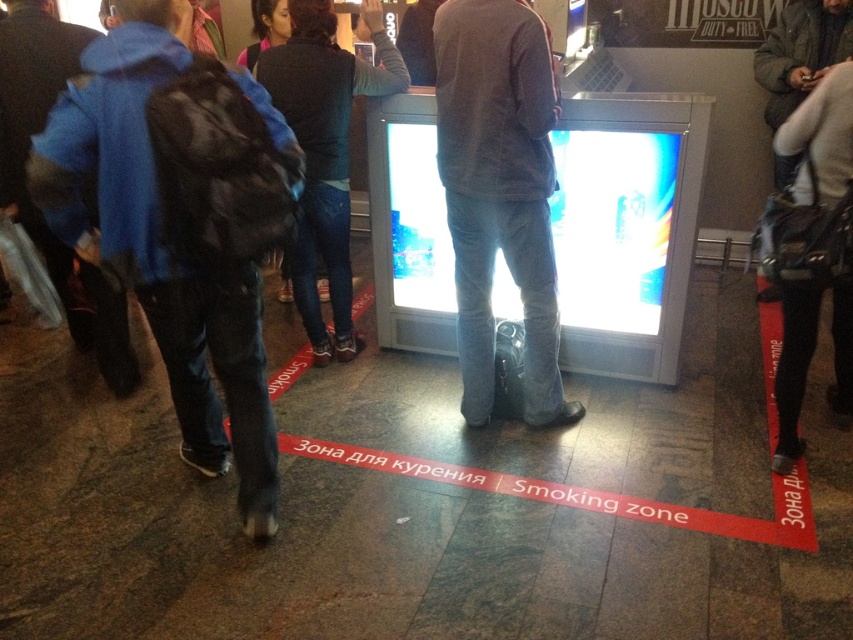
Question: Is dark gray sweater at center smaller than dark blue jeans at center?

Choices:
 (A) no
 (B) yes

Answer: (B)

Question: Can you confirm if dark gray sweater at center is wider than dark blue jeans at center?

Choices:
 (A) no
 (B) yes

Answer: (A)

Question: Based on their relative distances, which object is nearer to the dark gray sweater at center?

Choices:
 (A) matte blue jacket at left
 (B) dark blue jeans at center

Answer: (B)

Question: Estimate the real-world distances between objects in this image. Which object is closer to the matte blue jacket at left?

Choices:
 (A) dark gray sweater at center
 (B) dark blue jeans at center

Answer: (A)

Question: Which object is closer to the camera taking this photo?

Choices:
 (A) dark gray sweater at center
 (B) matte blue jacket at left

Answer: (B)

Question: Is dark gray sweater at center positioned behind dark blue jeans at center?

Choices:
 (A) no
 (B) yes

Answer: (A)